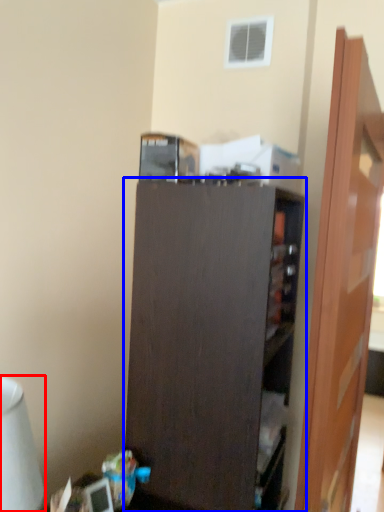
Question: Which object is further to the camera taking this photo, table lamp (highlighted by a red box) or cupboard (highlighted by a blue box)?

Choices:
 (A) table lamp
 (B) cupboard

Answer: (B)